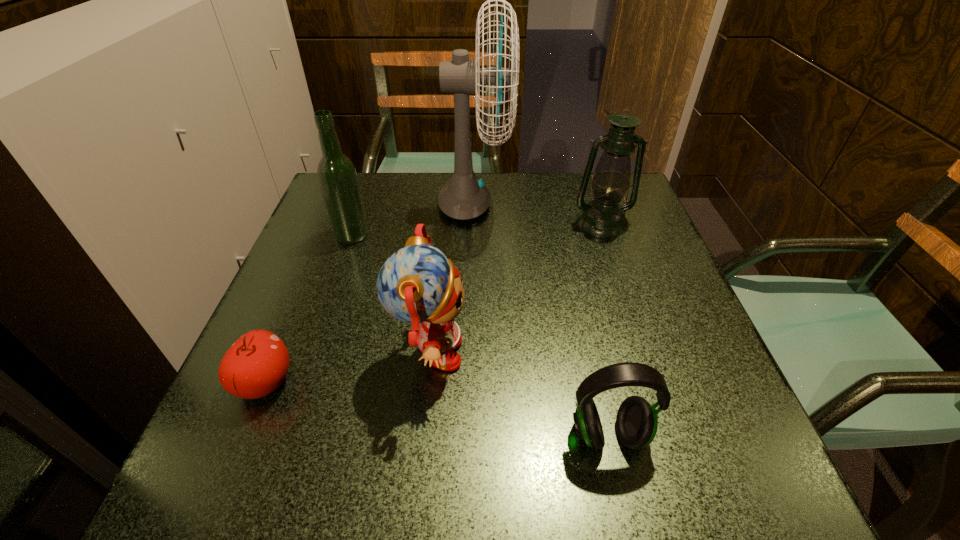
The width and height of the screenshot is (960, 540). What are the coordinates of `fan` in the screenshot? It's located at (464, 197).

Where is `liquor`? liquor is located at coordinates 337,176.

This screenshot has height=540, width=960. I want to click on oil lamp, so click(603, 216).

Locate an element on the screen. doll is located at coordinates (417, 284).

Where is `headset`? headset is located at coordinates (636, 422).

The height and width of the screenshot is (540, 960). Identify the location of the shortest object. (257, 363).

This screenshot has height=540, width=960. I want to click on free spot located 0.200m on the front-facing side of the tallest object, so click(587, 206).

This screenshot has height=540, width=960. I want to click on free space located 0.070m on the right of the liquor, so click(398, 235).

I want to click on vacant region located 0.120m on the left of the oil lamp, so click(524, 221).

Where is `blank space located 0.240m on the face of the doll`? The height and width of the screenshot is (540, 960). blank space located 0.240m on the face of the doll is located at coordinates (601, 355).